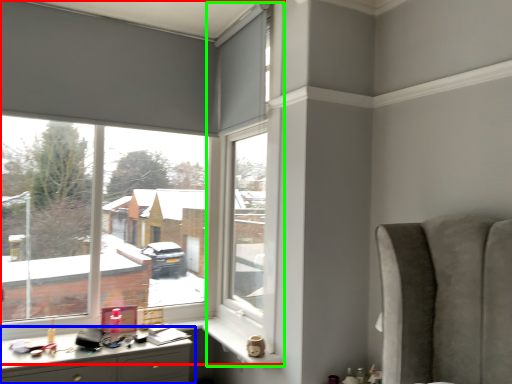
Question: Which is nearer to the window (highlighted by a red box)? desk (highlighted by a blue box) or window frame (highlighted by a green box).

Choices:
 (A) desk
 (B) window frame

Answer: (B)